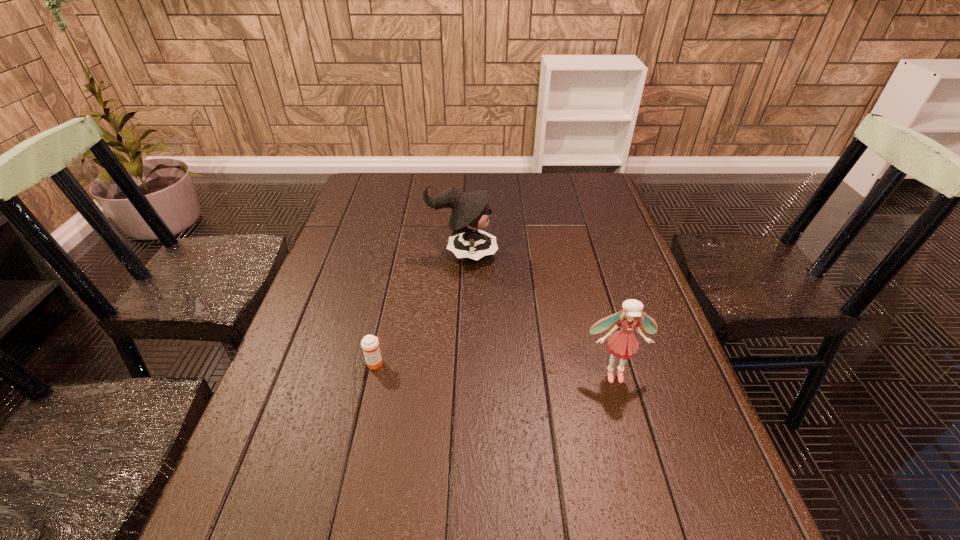
Where is `the farthest object`? the farthest object is located at coordinates (470, 211).

In order to click on the second object from left to right in this screenshot , I will do `click(470, 211)`.

Identify the location of the rightmost object. This screenshot has height=540, width=960. (623, 344).

Where is `the right doll`? the right doll is located at coordinates (623, 344).

Where is `medicine`? medicine is located at coordinates (370, 344).

Identify the location of the shortest object. The image size is (960, 540). click(x=370, y=344).

Identify the location of free space located 0.240m at the face of the second object from right to left. (581, 253).

This screenshot has height=540, width=960. In order to click on free location located 0.110m on the front-facing side of the right doll in this screenshot , I will do pyautogui.click(x=631, y=434).

You are a GUI agent. You are given a task and a screenshot of the screen. Output one action in this format:
    pyautogui.click(x=<x>, y=<y>)
    Task: Click on the vacant space located on the front of the leftmost object
    The image size is (960, 540).
    Given the screenshot: What is the action you would take?
    pyautogui.click(x=352, y=464)

The height and width of the screenshot is (540, 960). Identify the location of object that is positioned at the right edge. (623, 344).